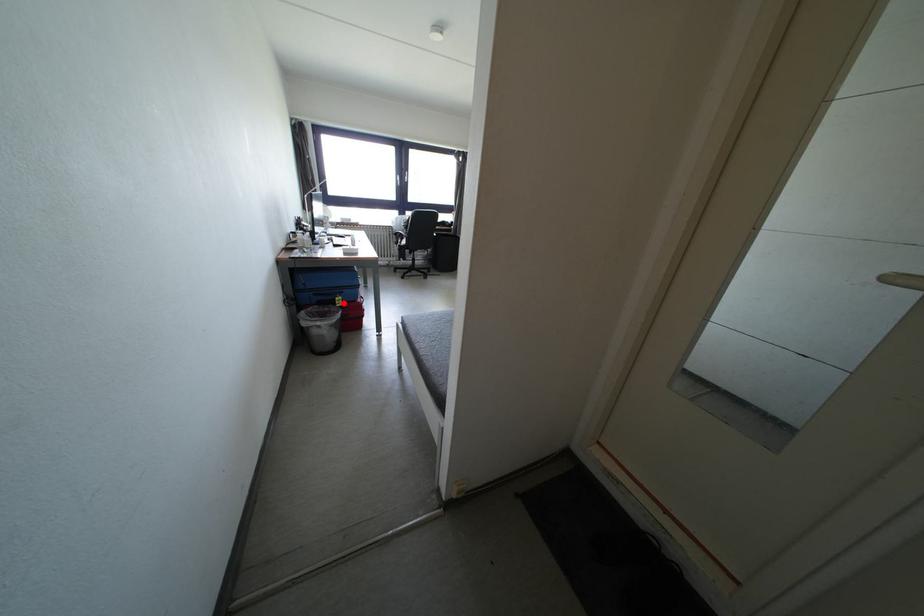
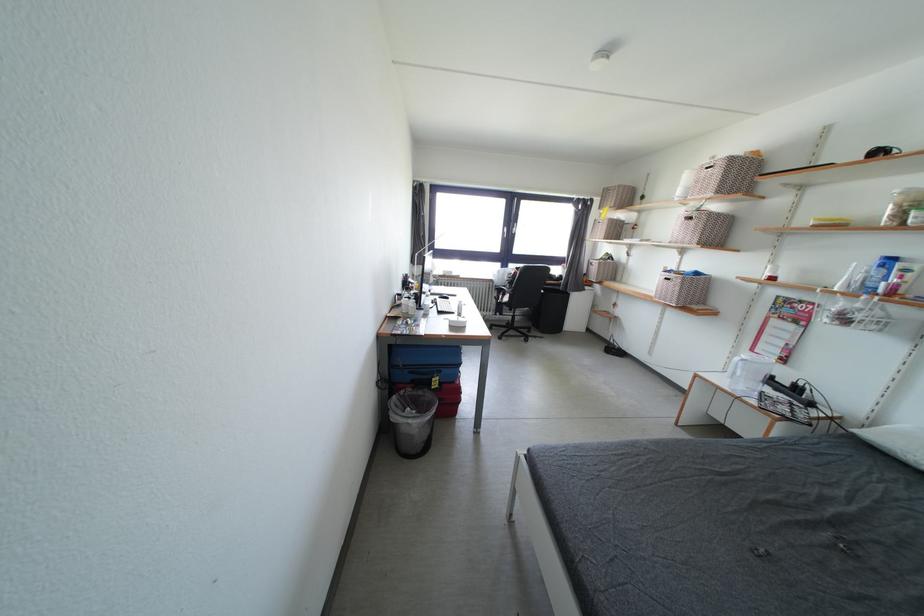
Question: A red point is marked in image1. In image2, is the corresponding 3D point closer to the camera or farther? Reply with the corresponding letter.

Choices:
 (A) The corresponding 3D point is closer.
 (B) The corresponding 3D point is farther.

Answer: (B)